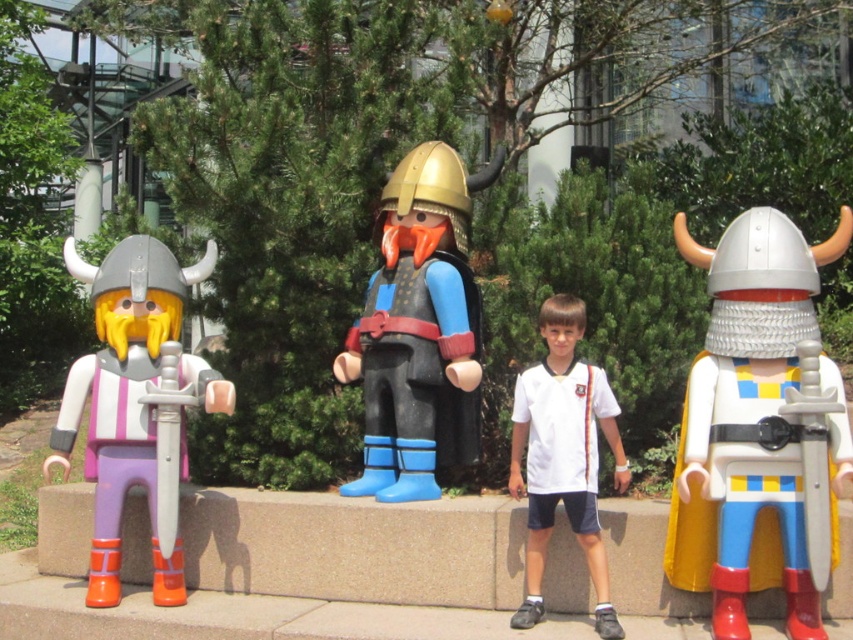
Question: Does matte white helmet at center come in front of blue rubber boot at center?

Choices:
 (A) no
 (B) yes

Answer: (B)

Question: Which is farther from the matte purple plastic viking at left?

Choices:
 (A) white smooth shirt at center
 (B) matte white helmet at center

Answer: (B)

Question: Which object is the closest to the blue rubber boot at center?

Choices:
 (A) white smooth shirt at center
 (B) matte white helmet at center

Answer: (A)

Question: Can you confirm if blue rubber boot at center is positioned below white smooth shirt at center?

Choices:
 (A) yes
 (B) no

Answer: (B)

Question: Observing the image, what is the correct spatial positioning of blue rubber boot at center in reference to matte purple plastic viking at left?

Choices:
 (A) below
 (B) above

Answer: (B)

Question: Which of the following is the closest to the observer?

Choices:
 (A) matte purple plastic viking at left
 (B) white smooth shirt at center
 (C) matte white helmet at center

Answer: (C)